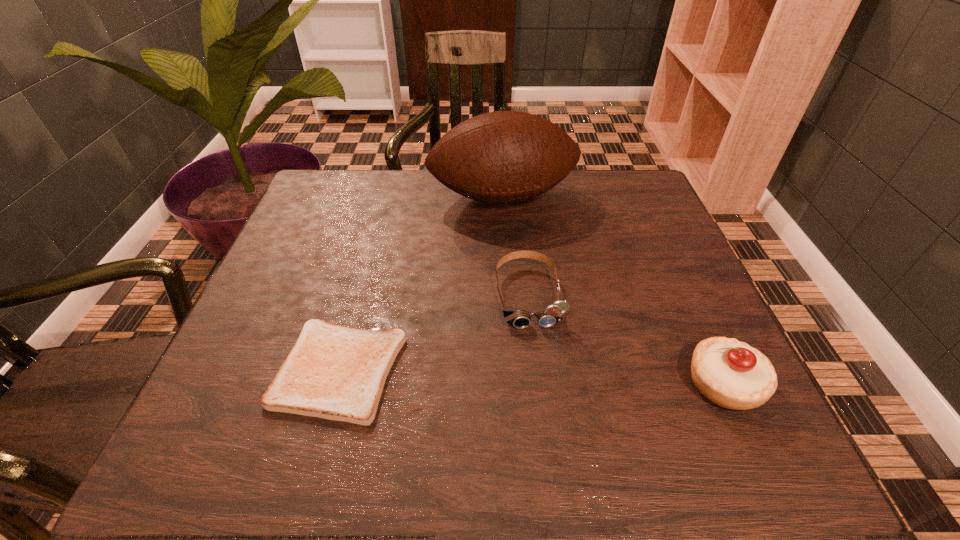
You are a GUI agent. You are given a task and a screenshot of the screen. Output one action in this format:
    pyautogui.click(x=<x>, y=<y>)
    Task: Click on the free space between the pastry and the tallest object
    This screenshot has height=540, width=960.
    Given the screenshot: What is the action you would take?
    pyautogui.click(x=613, y=291)

Identify the location of empty space between the third tallest object and the leftmost object. (434, 333).

What are the coordinates of `free space between the farthest object and the goggles` in the screenshot? It's located at (516, 246).

I want to click on empty space that is in between the goggles and the football, so [516, 246].

Locate an element on the screen. This screenshot has width=960, height=540. vacant space that is in between the pastry and the farthest object is located at coordinates (613, 291).

Identify which object is the second nearest to the toast. Please provide its 2D coordinates. Your answer should be formatted as a tuple, i.e. [(x, y)], where the tuple contains the x and y coordinates of a point satisfying the conditions above.

[(498, 157)]

Locate which object is the closest to the farthest object. Please provide its 2D coordinates. Your answer should be formatted as a tuple, i.e. [(x, y)], where the tuple contains the x and y coordinates of a point satisfying the conditions above.

[(520, 319)]

The image size is (960, 540). In order to click on free location that satisfies the following two spatial constraints: 1. on the front side of the second tallest object; 2. on the right side of the farthest object in this screenshot , I will do `click(516, 383)`.